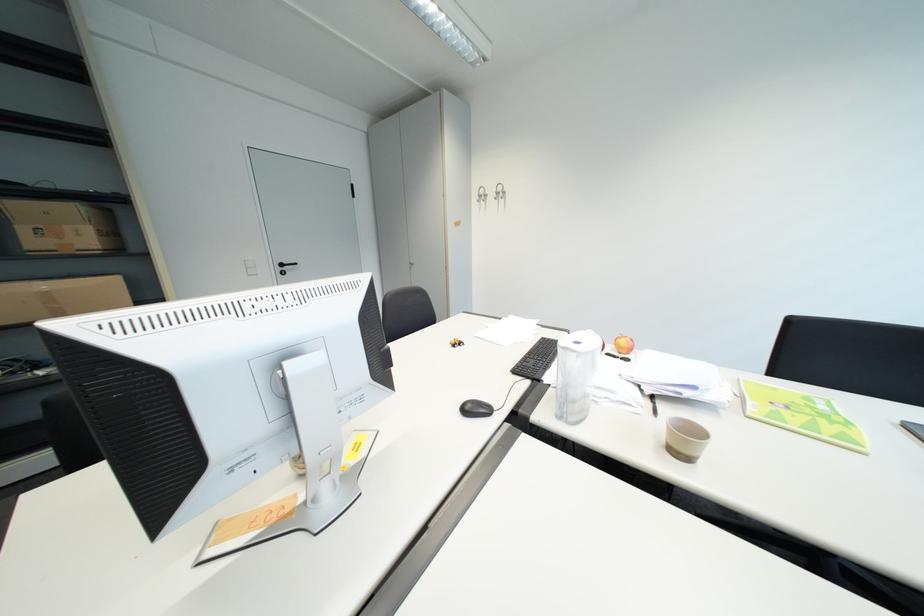
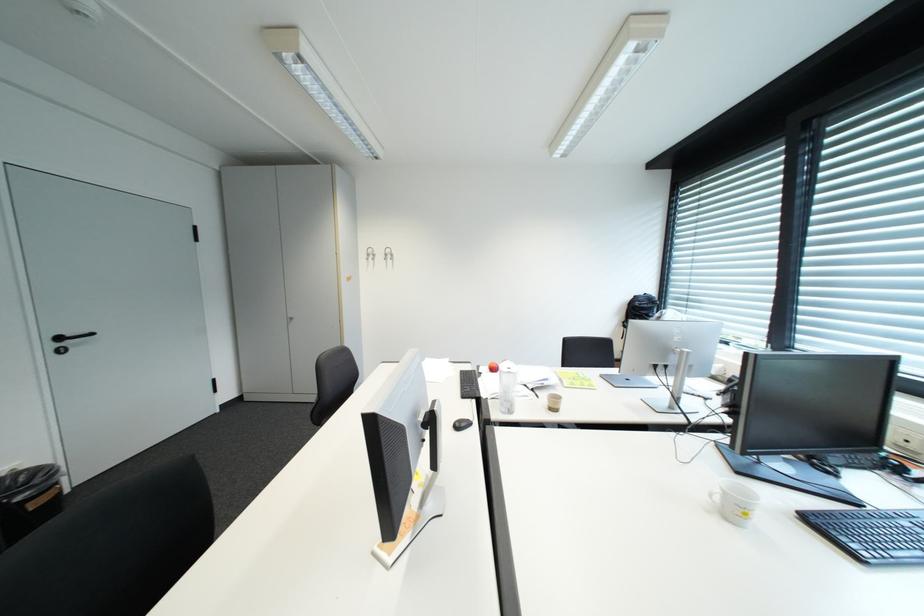
Question: The camera is either moving clockwise (left) or counter-clockwise (right) around the object. The first image is from the beginning of the video and the second image is from the end. Is the camera moving left or right when shooting the video?

Choices:
 (A) Left
 (B) Right

Answer: (A)